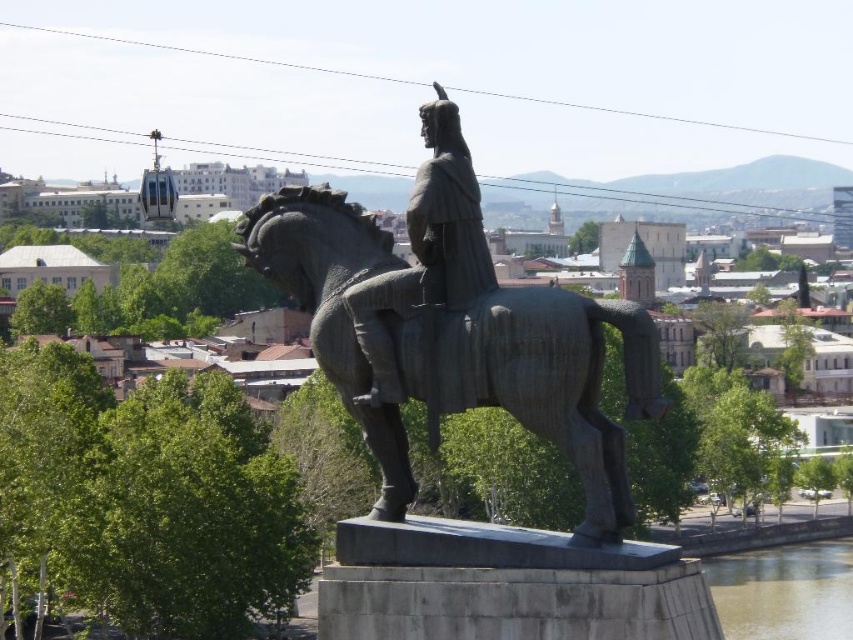
Question: Does bronze statue at center appear over brown murky water at lower right?

Choices:
 (A) yes
 (B) no

Answer: (A)

Question: Which point is closer to the camera?

Choices:
 (A) (589, 307)
 (B) (816, 596)

Answer: (A)

Question: Which object is the closest to the bronze textured horse at center?

Choices:
 (A) bronze statue at center
 (B) brown murky water at lower right

Answer: (A)

Question: Which point is closer to the camera taking this photo?

Choices:
 (A) tap(439, 129)
 (B) tap(469, 358)
 (C) tap(796, 556)

Answer: (B)

Question: Is bronze textured horse at center further to the viewer compared to bronze statue at center?

Choices:
 (A) no
 (B) yes

Answer: (A)

Question: Can you confirm if bronze textured horse at center is bigger than brown murky water at lower right?

Choices:
 (A) no
 (B) yes

Answer: (A)